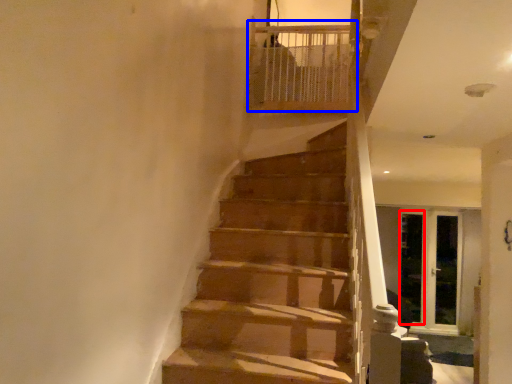
Question: Which object is further to the camera taking this photo, screen door (highlighted by a red box) or balustrade (highlighted by a blue box)?

Choices:
 (A) screen door
 (B) balustrade

Answer: (A)